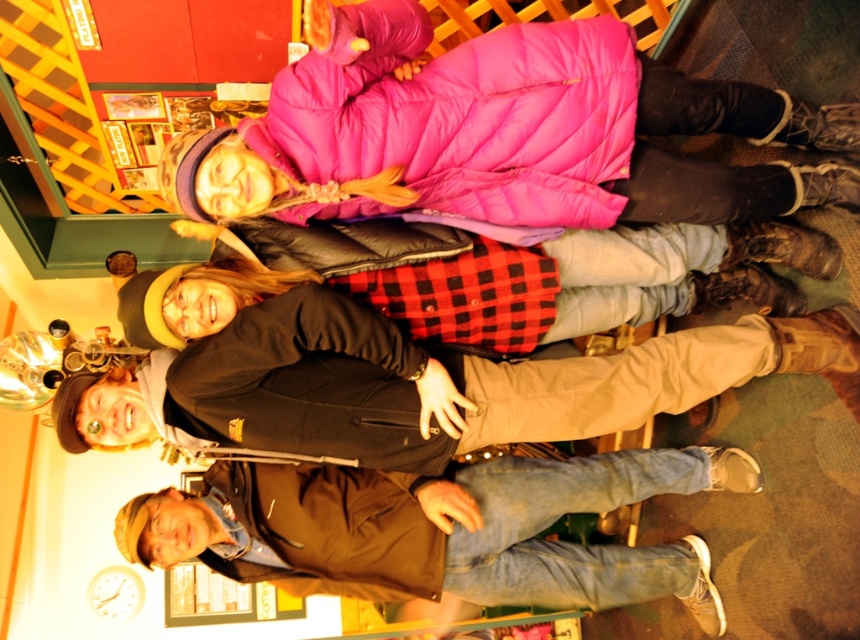
Question: Is pink puffy coat at upper center to the left of brown leather jacket at lower right from the viewer's perspective?

Choices:
 (A) yes
 (B) no

Answer: (B)

Question: Which point appears closest to the camera in this image?

Choices:
 (A) (809, 253)
 (B) (556, 413)
 (C) (232, 493)

Answer: (A)

Question: Is pink puffy coat at upper center smaller than black cotton jacket at center?

Choices:
 (A) yes
 (B) no

Answer: (B)

Question: Which object is the farthest from the pink puffy coat at upper center?

Choices:
 (A) black quilted jacket at upper center
 (B) black cotton jacket at center

Answer: (B)

Question: Among these objects, which one is nearest to the camera?

Choices:
 (A) black quilted jacket at upper center
 (B) pink puffy coat at upper center

Answer: (B)

Question: Is black cotton jacket at center thinner than brown leather jacket at lower right?

Choices:
 (A) yes
 (B) no

Answer: (B)